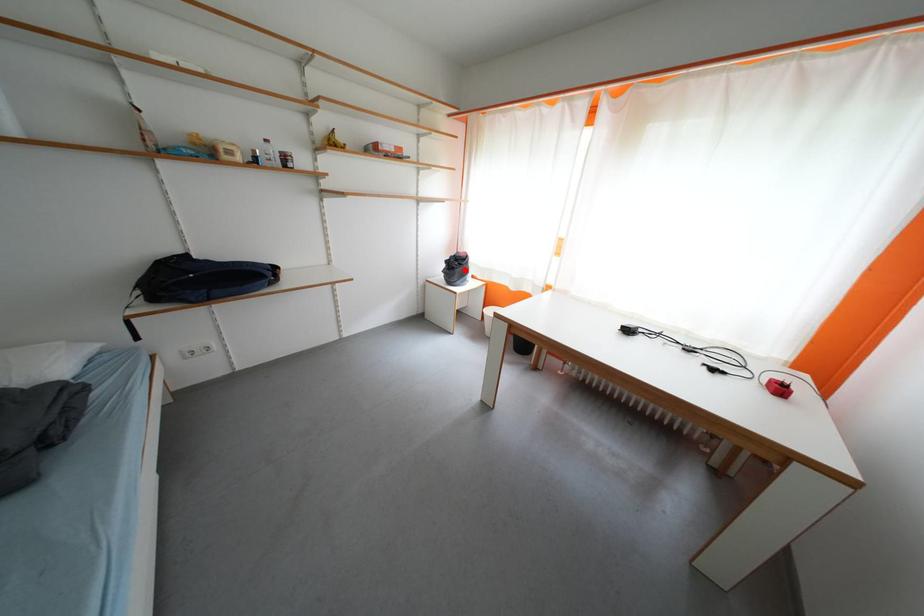
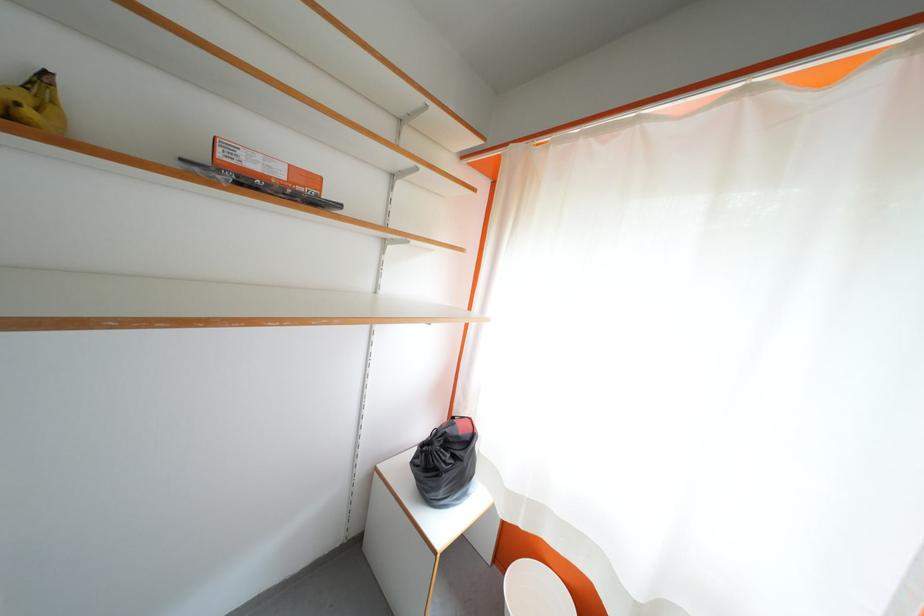
Question: I am providing you with two images of the same scene from different viewpoints. Given a red point in image1, look at the same physical point in image2. Is it:

Choices:
 (A) Closer to the viewpoint
 (B) Farther from the viewpoint

Answer: (B)